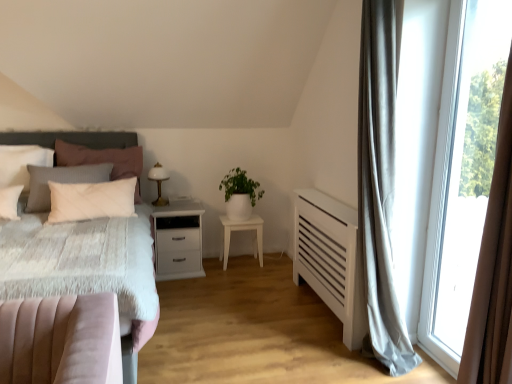
Image resolution: width=512 pixels, height=384 pixels. Find the location of `unoccupied region to the right of white matte nightstand at center, which is the first nightstand from left to right`. unoccupied region to the right of white matte nightstand at center, which is the first nightstand from left to right is located at coordinates (225, 276).